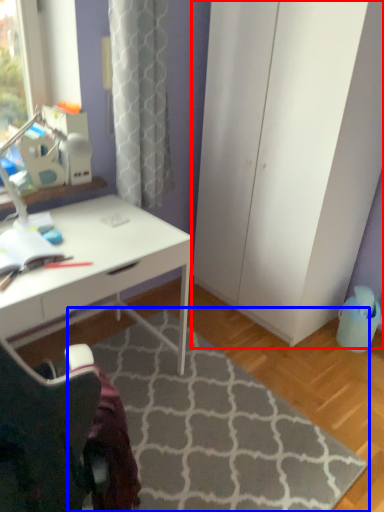
Question: Among these objects, which one is nearest to the camera, screen door (highlighted by a red box) or doormat (highlighted by a blue box)?

Choices:
 (A) screen door
 (B) doormat

Answer: (B)